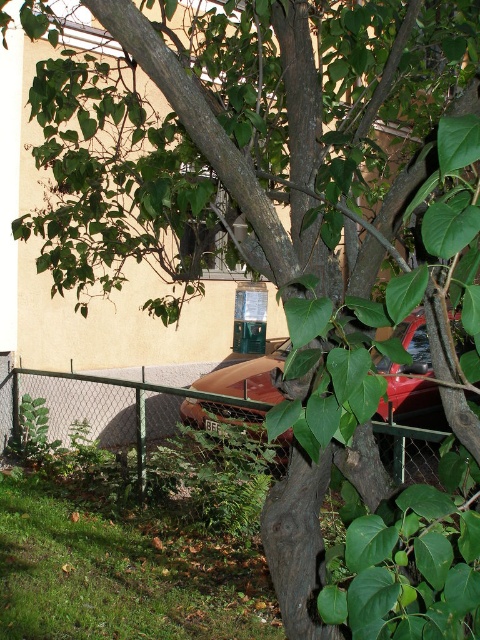
You are standing in front of the tree and want to determine which of the two points, point (171, 396) or point (244, 378), is closer to you. Based on the scene, which point is nearer?

Point (171, 396) is closer to you because it is further to the viewer than point (244, 378).